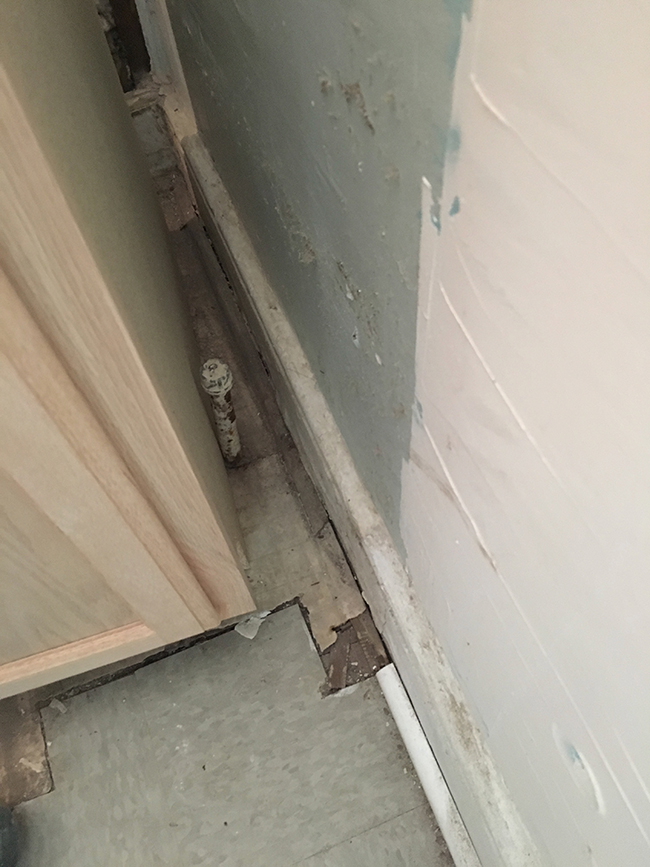
The width and height of the screenshot is (650, 867). I want to click on exposed brown floor beneath tile, so click(31, 763).